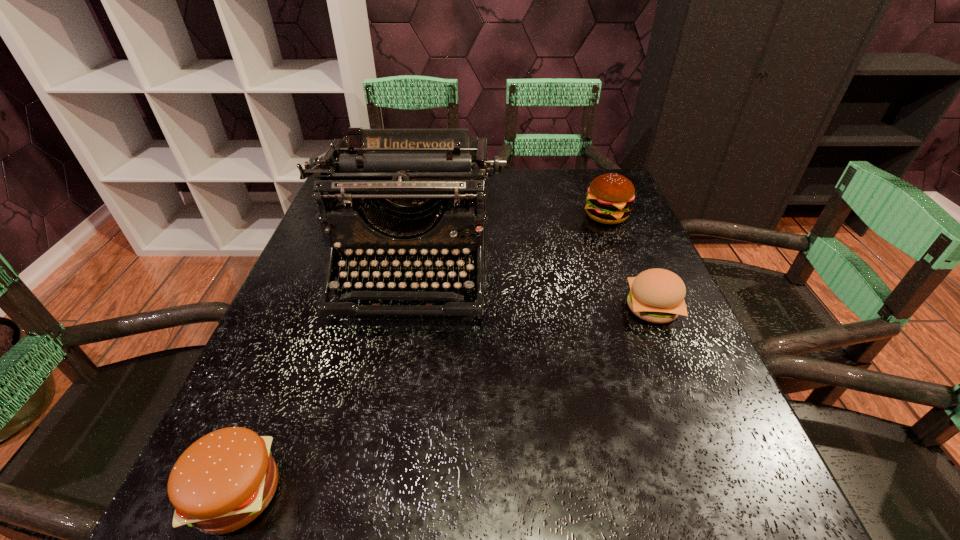
The image size is (960, 540). Find the location of `object that is the second closest to the second nearest hamburger`. object that is the second closest to the second nearest hamburger is located at coordinates (419, 170).

Identify which hamburger is the closest to the tallest hamburger. Please provide its 2D coordinates. Your answer should be formatted as a tuple, i.e. [(x, y)], where the tuple contains the x and y coordinates of a point satisfying the conditions above.

[(656, 295)]

Image resolution: width=960 pixels, height=540 pixels. What are the coordinates of `hamburger that is the closest one to the second farthest hamburger` in the screenshot? It's located at (610, 196).

The image size is (960, 540). I want to click on blank space that satisfies the following two spatial constraints: 1. on the typing side of the typewriter; 2. on the right side of the second farthest hamburger, so click(405, 308).